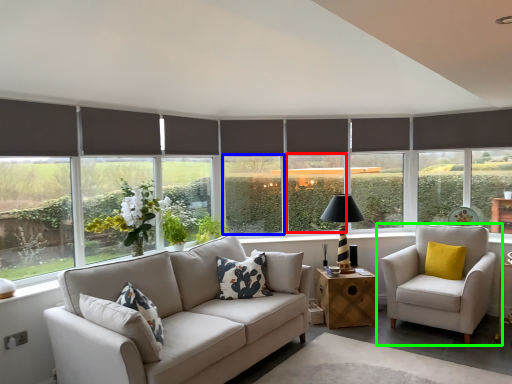
Question: Which object is the closest to the window (highlighted by a red box)? Choose among these: window screen (highlighted by a blue box) or chair (highlighted by a green box).

Choices:
 (A) window screen
 (B) chair

Answer: (A)